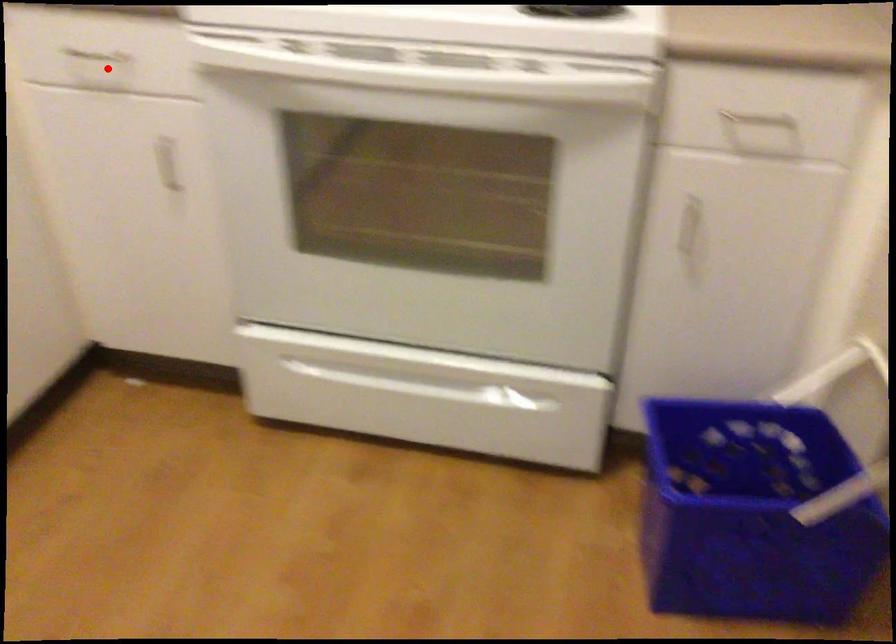
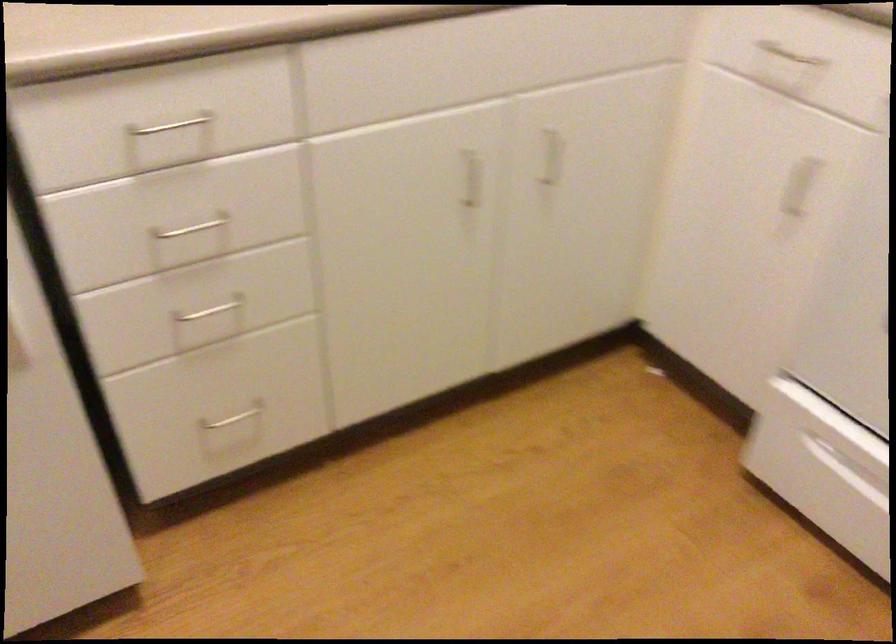
The point at the highlighted location is marked in the first image. Where is the corresponding point in the second image?

(789, 55)